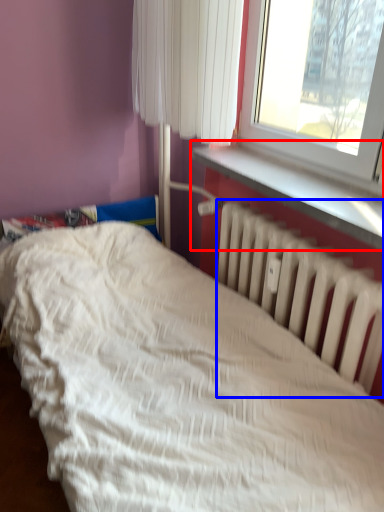
Question: Which of the following is the closest to the observer, window sill (highlighted by a red box) or radiator (highlighted by a blue box)?

Choices:
 (A) window sill
 (B) radiator

Answer: (A)